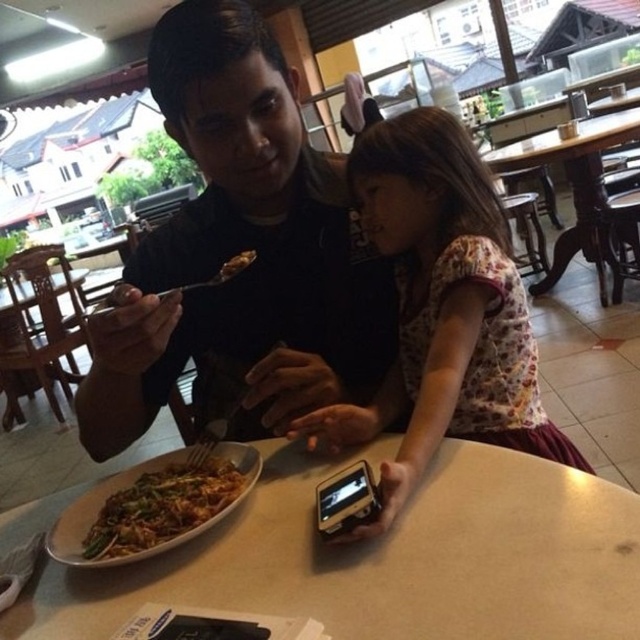
Question: From the image, what is the correct spatial relationship of matte black shirt at center in relation to brown matte food at upper center?

Choices:
 (A) left
 (B) right

Answer: (A)

Question: Which object is farther from the camera taking this photo?

Choices:
 (A) brown matte food at upper center
 (B) white matte table at center
 (C) green matte noodles at lower left

Answer: (A)

Question: Is white matte table at center wider than floral fabric shirt at center?

Choices:
 (A) no
 (B) yes

Answer: (B)

Question: Among these objects, which one is farthest from the camera?

Choices:
 (A) white matte table at center
 (B) brown matte food at upper center
 (C) wooden table at center

Answer: (C)

Question: Can you confirm if white matte table at center is positioned below floral fabric shirt at center?

Choices:
 (A) yes
 (B) no

Answer: (A)

Question: Which is farther from the white matte table at center?

Choices:
 (A) green matte noodles at lower left
 (B) matte black shirt at center

Answer: (B)